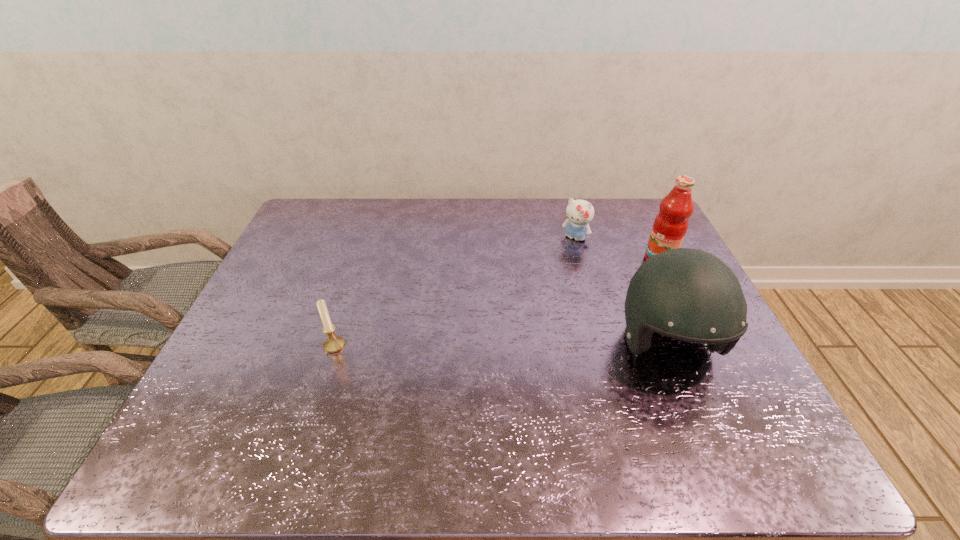
Where is `free spot on the desktop that is between the candle holder and the football helmet and is positioned on the front-facing side of the farthest object`? Image resolution: width=960 pixels, height=540 pixels. free spot on the desktop that is between the candle holder and the football helmet and is positioned on the front-facing side of the farthest object is located at coordinates (500, 345).

Locate an element on the screen. vacant space on the desktop that is between the candle holder and the football helmet and is positioned on the front label of the fruit juice is located at coordinates (507, 345).